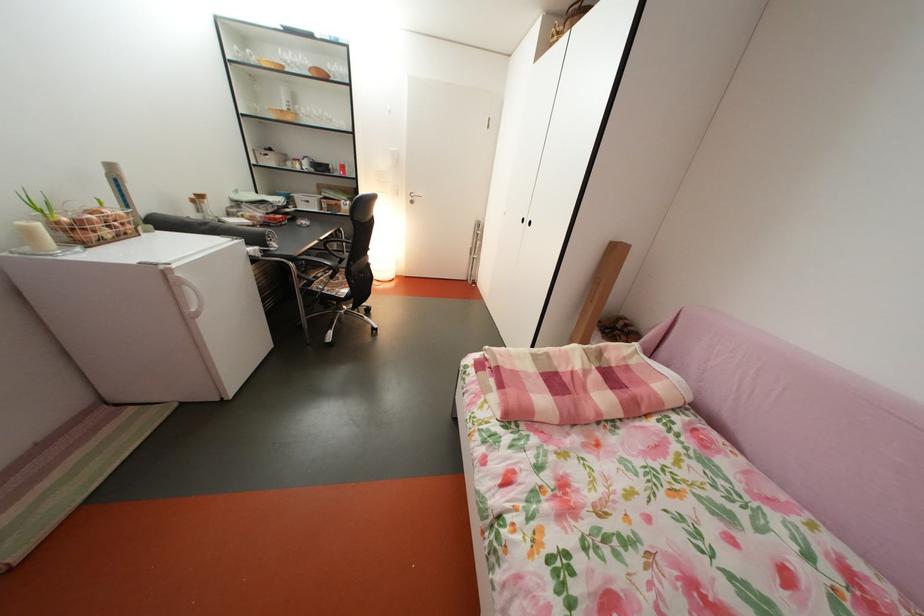
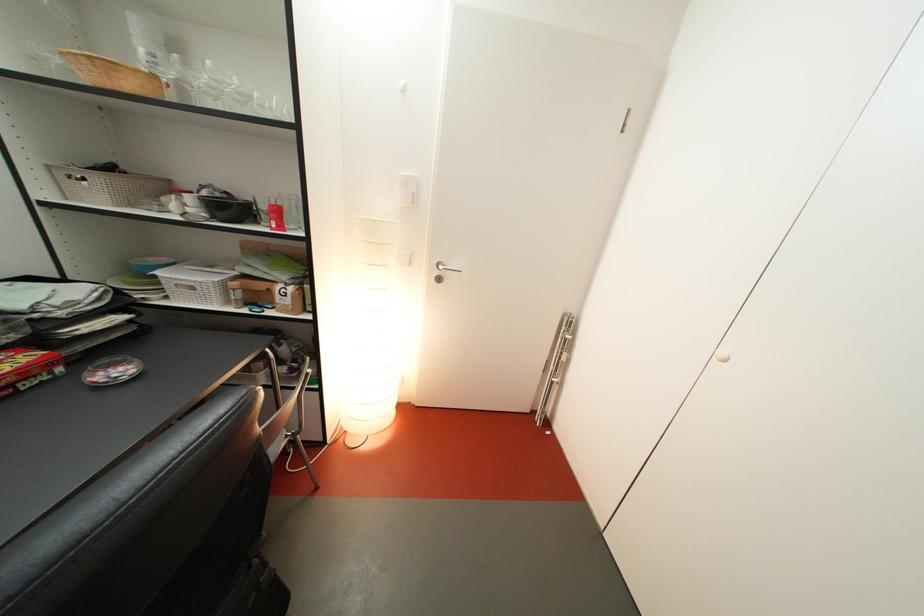
Question: What movement of the cameraman would produce the second image?

Choices:
 (A) Left
 (B) Right
 (C) Forward
 (D) Backward

Answer: (C)